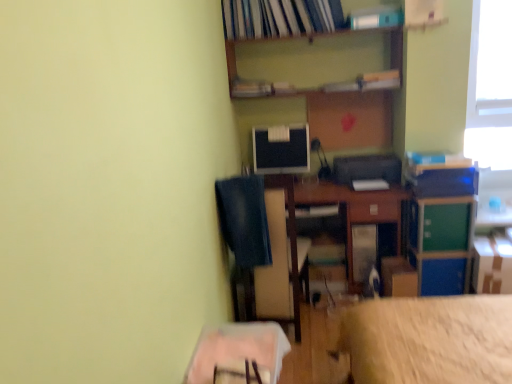
This screenshot has width=512, height=384. Describe the element at coordinates (441, 243) in the screenshot. I see `green plastic file cabinet at right` at that location.

The image size is (512, 384). Describe the element at coordinates (244, 232) in the screenshot. I see `denim at left` at that location.

This screenshot has width=512, height=384. I want to click on denim at left, so (244, 232).

The width and height of the screenshot is (512, 384). I want to click on wooden desk at center, which ranks as the second table in left-to-right order, so (x=346, y=207).

The image size is (512, 384). I want to click on matte black monitor at center, so click(x=281, y=149).

The height and width of the screenshot is (384, 512). Describe the element at coordinates (376, 18) in the screenshot. I see `white plastic book at upper center, marked as the second book in a top-to-bottom arrangement` at that location.

This screenshot has height=384, width=512. In order to click on green plastic file cabinet at right in this screenshot , I will do tap(441, 243).

Is matte plastic book at upper center, the first book when ordered from bottom to top, behind matte black monitor at center?

No, it is in front of matte black monitor at center.

Does matte plastic book at upper center, the first book when ordered from bottom to top, have a larger size compared to matte black monitor at center?

No, matte plastic book at upper center, the first book when ordered from bottom to top, is not bigger than matte black monitor at center.

Is matte plastic book at upper center, the first book when ordered from bottom to top, in contact with matte black monitor at center?

No, matte plastic book at upper center, the first book when ordered from bottom to top, is not next to matte black monitor at center.

Which object is positioned more to the right, matte plastic book at upper center, the first book when ordered from bottom to top, or matte black monitor at center?

Positioned to the right is matte black monitor at center.

Is green plastic file cabinet at right touching matte black monitor at center?

No, green plastic file cabinet at right is not next to matte black monitor at center.

I want to click on computer monitor behind the green plastic file cabinet at right, so click(281, 149).

Is green plastic file cabinet at right located outside matte black monitor at center?

green plastic file cabinet at right lies outside matte black monitor at center's area.

In the scene shown: Between green plastic file cabinet at right and matte black monitor at center, which one has larger width?

Wider between the two is green plastic file cabinet at right.

Can we say matte plastic book at upper center, the first book when ordered from bottom to top, lies outside denim at left?

Indeed, matte plastic book at upper center, the first book when ordered from bottom to top, is completely outside denim at left.

Does matte plastic book at upper center, the first book when ordered from bottom to top, come behind denim at left?

That is True.

Does matte plastic book at upper center, the first book when ordered from bottom to top, have a lesser width compared to denim at left?

Yes, matte plastic book at upper center, the first book when ordered from bottom to top, is thinner than denim at left.

Is matte plastic book at upper center, which appears as the third book when viewed from the top, turned away from denim at left?

No, denim at left is not at the back of matte plastic book at upper center, which appears as the third book when viewed from the top.

From a real-world perspective, is white plastic book at upper center, which appears as the second book when ordered from the bottom, below wooden at upper center?

No.

Based on the photo, which is nearer, (x=387, y=13) or (x=248, y=95)?

Clearly, point (x=387, y=13) is closer to the camera than point (x=248, y=95).

Based on the photo, is white plastic book at upper center, which appears as the second book when ordered from the bottom, behind wooden at upper center?

No, white plastic book at upper center, which appears as the second book when ordered from the bottom, is closer to the viewer.

You are a GUI agent. You are given a task and a screenshot of the screen. Output one action in this format:
    pyautogui.click(x=<x>, y=<y>)
    Task: Click on the computer monitor on the right of hardcover book at upper center, arranged as the first book when viewed from the top
    Image resolution: width=512 pixels, height=384 pixels.
    Given the screenshot: What is the action you would take?
    pyautogui.click(x=281, y=149)

Based on the photo, does hardcover book at upper center, arranged as the first book when viewed from the top, contain matte black monitor at center?

Definitely not — matte black monitor at center is not inside hardcover book at upper center, arranged as the first book when viewed from the top.

Based on the photo, does hardcover book at upper center, arranged as the first book when viewed from the top, have a larger size compared to matte black monitor at center?

Correct, hardcover book at upper center, arranged as the first book when viewed from the top, is larger in size than matte black monitor at center.

From a real-world perspective, is hardcover book at upper center, acting as the third book starting from the bottom, positioned over matte black monitor at center based on gravity?

Correct, in the physical world, hardcover book at upper center, acting as the third book starting from the bottom, is higher than matte black monitor at center.

From the image's perspective, would you say denim at left is positioned over white plastic book at upper center, which appears as the second book when ordered from the bottom?

No, from the image's perspective, denim at left is not on top of white plastic book at upper center, which appears as the second book when ordered from the bottom.

Considering the sizes of objects denim at left and white plastic book at upper center, which appears as the second book when ordered from the bottom, in the image provided, who is wider, denim at left or white plastic book at upper center, which appears as the second book when ordered from the bottom,?

Wider between the two is denim at left.

Locate an element on the screen. the 3rd book to the right when counting from the denim at left is located at coordinates (376, 18).

Looking at this image, is denim at left to the right of white plastic book at upper center, which appears as the second book when ordered from the bottom, from the viewer's perspective?

Incorrect, denim at left is not on the right side of white plastic book at upper center, which appears as the second book when ordered from the bottom.

Who is smaller, matte black monitor at center or metallic gray computer tower at center?

With smaller size is matte black monitor at center.

Does matte black monitor at center have a lesser height compared to metallic gray computer tower at center?

Incorrect, the height of matte black monitor at center does not fall short of that of metallic gray computer tower at center.

Which object is positioned more to the left, matte black monitor at center or metallic gray computer tower at center?

From the viewer's perspective, matte black monitor at center appears more on the left side.

The image size is (512, 384). I want to click on the 1st book positioned above the matte black monitor at center (from a real-world perspective), so click(x=259, y=88).

Find the location of `computer monitor behind the green plastic file cabinet at right`. computer monitor behind the green plastic file cabinet at right is located at coordinates (281, 149).

Which object lies further to the anchor point matte black monitor at center, wooden desk at center, which ranks as the second table in left-to-right order, or cardboard box at lower right, arranged as the second cardboard box when viewed from the right?

Based on the image, cardboard box at lower right, arranged as the second cardboard box when viewed from the right, appears to be further to matte black monitor at center.

Looking at the image, which one is located closer to hardcover book at upper center, arranged as the first book when viewed from the top, wooden at upper center or matte black monitor at center?

wooden at upper center is closer to hardcover book at upper center, arranged as the first book when viewed from the top.

Based on their spatial positions, is cardboard box at lower right, positioned as the 2th cardboard box in left-to-right order, or wooden desk at center, which is the 2th table in front-to-back order, closer to matte black monitor at center?

wooden desk at center, which is the 2th table in front-to-back order, is positioned closer to the anchor matte black monitor at center.

When comparing their distances from green plastic file cabinet at right, does matte plastic book at upper center, which appears as the third book when viewed from the top, or matte black monitor at center seem closer?

matte black monitor at center is closer to green plastic file cabinet at right.

Estimate the real-world distances between objects in this image. Which object is closer to green plastic file cabinet at right, metallic gray computer tower at center or cardboard box at lower right, placed as the 1th cardboard box when sorted from right to left?

Based on the image, cardboard box at lower right, placed as the 1th cardboard box when sorted from right to left, appears to be nearer to green plastic file cabinet at right.

Based on their spatial positions, is cardboard box at lower right, arranged as the second cardboard box when viewed from the right, or wooden desk at center, which ranks as the second table in left-to-right order, further from green plastic file cabinet at right?

wooden desk at center, which ranks as the second table in left-to-right order.

Considering their positions, is cardboard box at lower right, which is counted as the 1th cardboard box, starting from the left, positioned closer to hardcover book at upper center, acting as the third book starting from the bottom, than cardboard box at lower right, placed as the 1th cardboard box when sorted from right to left?

cardboard box at lower right, which is counted as the 1th cardboard box, starting from the left, is positioned closer to the anchor hardcover book at upper center, acting as the third book starting from the bottom.

Which object lies further to the anchor point cardboard box at lower right, arranged as the second cardboard box when viewed from the right, hardcover book at upper center, arranged as the first book when viewed from the top, or metallic gray computer tower at center?

hardcover book at upper center, arranged as the first book when viewed from the top, is further to cardboard box at lower right, arranged as the second cardboard box when viewed from the right.

Find the location of a particular element. This screenshot has height=384, width=512. cardboard box between matte plastic book at upper center, which appears as the third book when viewed from the top, and cardboard box at lower right, placed as the 1th cardboard box when sorted from right to left is located at coordinates (398, 277).

Where is `file cabinet between matte plastic book at upper center, the first book when ordered from bottom to top, and wooden table at lower center, which is the second table in back-to-front order, vertically`? file cabinet between matte plastic book at upper center, the first book when ordered from bottom to top, and wooden table at lower center, which is the second table in back-to-front order, vertically is located at coordinates (441, 243).

Locate an element on the screen. The height and width of the screenshot is (384, 512). shelf between white plastic book at upper center, marked as the second book in a top-to-bottom arrangement, and green plastic file cabinet at right from top to bottom is located at coordinates (302, 37).

Identify the location of computer tower between denim at left and cardboard box at lower right, positioned as the 2th cardboard box in left-to-right order. This screenshot has width=512, height=384. (372, 248).